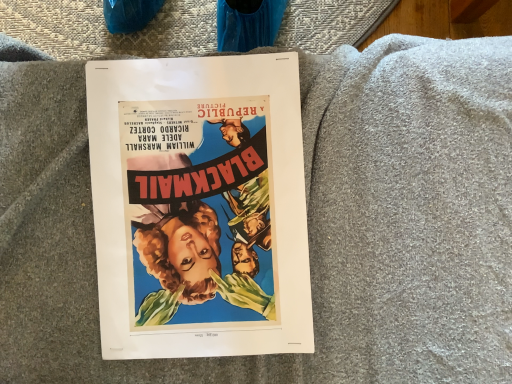
Question: Should I look upward or downward to see vibrant paper poster at center?

Choices:
 (A) down
 (B) up

Answer: (A)